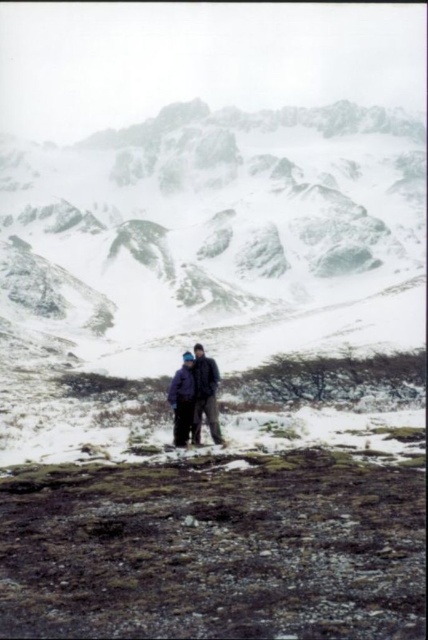
Which is more to the left, matte purple jacket at center or dark blue jacket at center?

dark blue jacket at center

Does matte purple jacket at center have a greater width compared to dark blue jacket at center?

Correct, the width of matte purple jacket at center exceeds that of dark blue jacket at center.

Who is more forward, (216, 424) or (184, 419)?

Point (216, 424) is more forward.

Identify the location of matte purple jacket at center. The width and height of the screenshot is (428, 640). (196, 396).

Does snowy rock mountain at center have a greater height compared to matte purple jacket at center?

Indeed, snowy rock mountain at center has a greater height compared to matte purple jacket at center.

Who is more distant from viewer, (329, 292) or (199, 368)?

Positioned behind is point (329, 292).

I want to click on snowy rock mountain at center, so click(205, 248).

Between snowy rock mountain at center and dark blue jacket at center, which one appears on the left side from the viewer's perspective?

snowy rock mountain at center

Between point (380, 129) and point (172, 403), which one is positioned behind?

Positioned behind is point (380, 129).

Identify the location of snowy rock mountain at center. This screenshot has width=428, height=640. (205, 248).